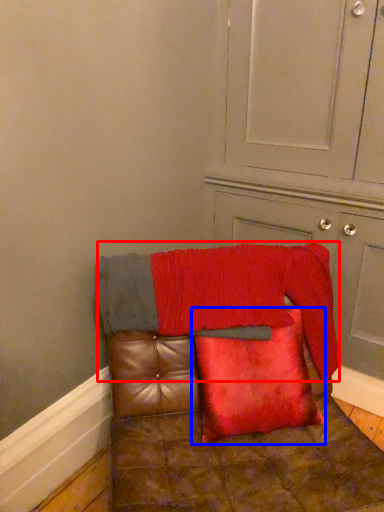
Question: Among these objects, which one is nearest to the camera, blanket (highlighted by a red box) or pillow (highlighted by a blue box)?

Choices:
 (A) blanket
 (B) pillow

Answer: (B)